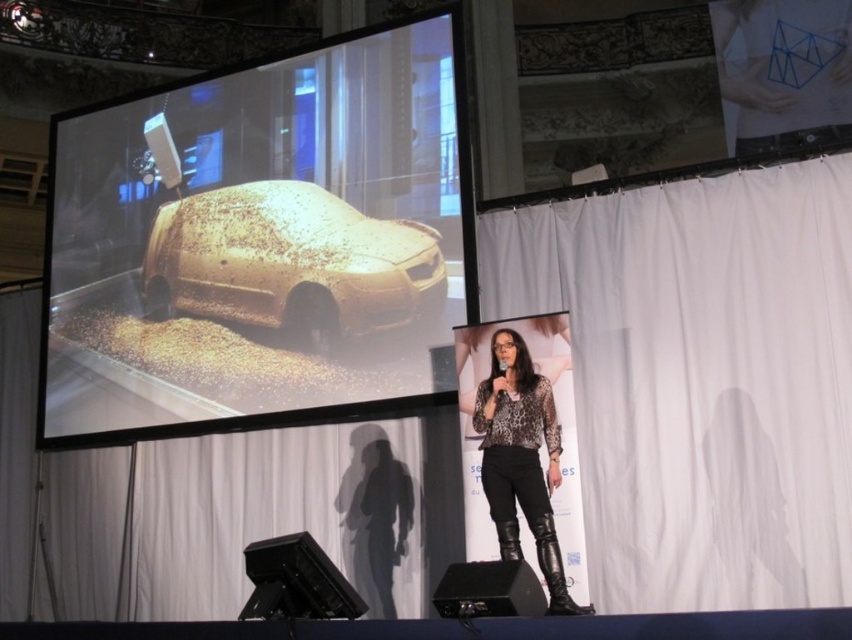
You are an event planner organizing a car show and need to decide where to place promotional materials. Given the gold glitter car at upper left and the leopard print blouse at center, which object should you place a larger promotional banner in front of to ensure visibility?

The gold glitter car at upper left is larger in size than the leopard print blouse at center, so placing a larger promotional banner in front of the gold glitter car at upper left would ensure better visibility due to its larger size.

You are a photographer standing at the back of the auditorium. You want to take a closeup photo of the gold glitter car at upper left. Considering the distance, can you capture it clearly without moving closer?

The gold glitter car at upper left is 101.68 feet away from the camera. At this distance, capturing a clear closeup without moving closer would be challenging unless using a high zoom lens capable of reaching such distances.